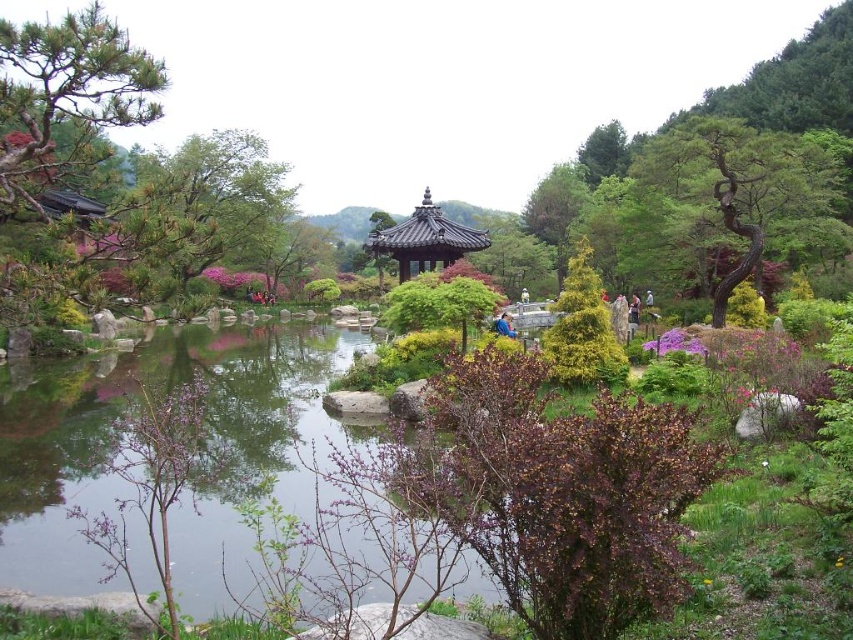
You are a visitor in the garden and want to take a photo of the shiny dark brown gazebo at center without the bare bark tree at upper right blocking the view. Is there a way to position yourself so that the gazebo is visible without the tree in the frame?

The bare bark tree at upper right is positioned over the shiny dark brown gazebo at center, so it will block the gazebo. To avoid the tree, move to a position where the gazebo is framed below the tree or shift your angle so the tree is out of the shot.

You are planning to place a small decorative statue in the traditional Korean garden. The statue is exactly the same size as the green textured bush at center. Will the statue fit under the shiny dark brown gazebo at center without touching the edges?

The green textured bush at center is smaller than the shiny dark brown gazebo at center, so the statue, being the same size as the bush, should fit under the gazebo without touching the edges.